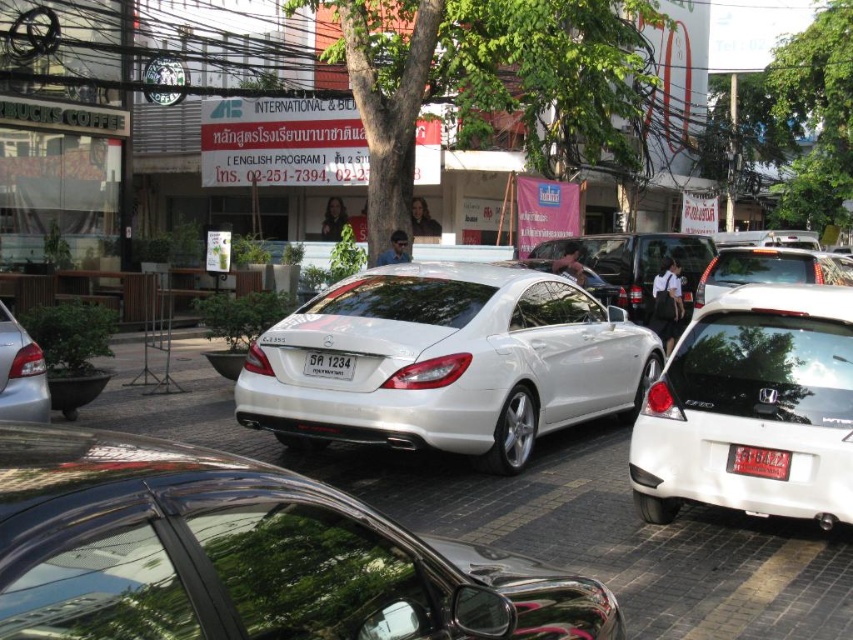
Who is shorter, sleek silver sedan at center or white glossy sedan at center-right?

white glossy sedan at center-right is shorter.

Which is in front, point (538, 368) or point (828, 408)?

Point (828, 408)

This screenshot has height=640, width=853. I want to click on sleek silver sedan at center, so click(447, 362).

Is point (755, 352) less distant than point (339, 372)?

Yes, point (755, 352) is in front of point (339, 372).

Does white glossy sedan at center-right have a smaller size compared to white plastic license plate at center?

No.

This screenshot has height=640, width=853. What do you see at coordinates (752, 406) in the screenshot?
I see `white glossy sedan at center-right` at bounding box center [752, 406].

Where is `white glossy sedan at center-right`? The image size is (853, 640). white glossy sedan at center-right is located at coordinates (752, 406).

Is glossy metallic car at center to the right of white glossy sedan at center-right from the viewer's perspective?

Incorrect, glossy metallic car at center is not on the right side of white glossy sedan at center-right.

Between glossy metallic car at center and white glossy sedan at center-right, which one is positioned higher?

white glossy sedan at center-right is higher up.

What do you see at coordinates (244, 554) in the screenshot? I see `glossy metallic car at center` at bounding box center [244, 554].

Locate an element on the screen. The height and width of the screenshot is (640, 853). glossy metallic car at center is located at coordinates (244, 554).